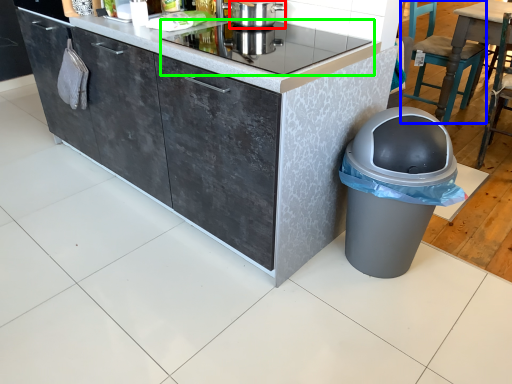
Question: Which is nearer to the kitchen appliance (highlighted by a red box)? chair (highlighted by a blue box) or home appliance (highlighted by a green box).

Choices:
 (A) chair
 (B) home appliance

Answer: (B)